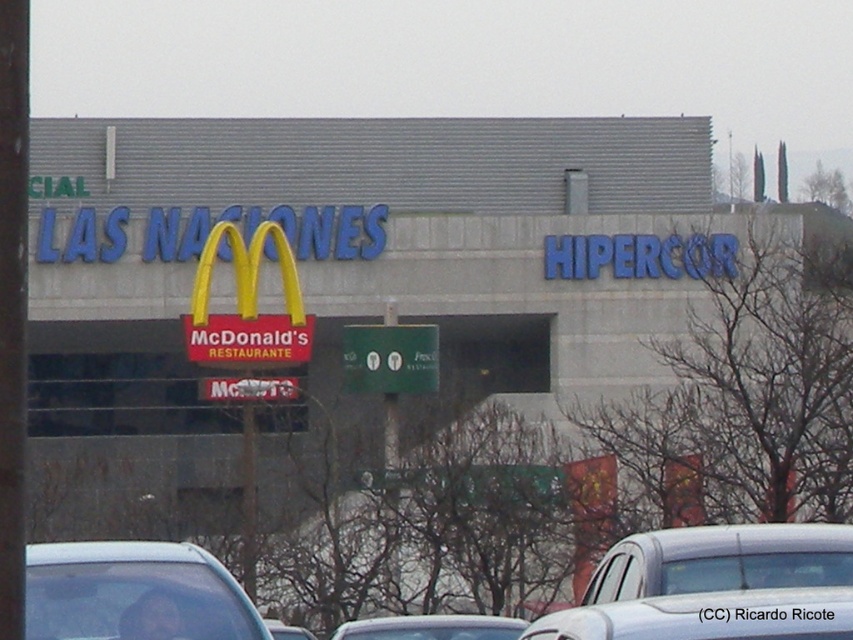
You are standing in front of the commercial building and want to take a photo of the green matte sign at center without the white glossy car at center blocking it. Where should you move to achieve this?

Move behind the white glossy car at center so that the green matte sign at center becomes visible without obstruction.

You are standing at the entrance of the commercial building and want to park your car. The parking lot has a designated parking spot marked at point (708, 616). Can you safely park your car in that spot without blocking the entrance?

The white glossy car at center is located at point (708, 616), so parking there would block the entrance as the car is already occupying that spot.